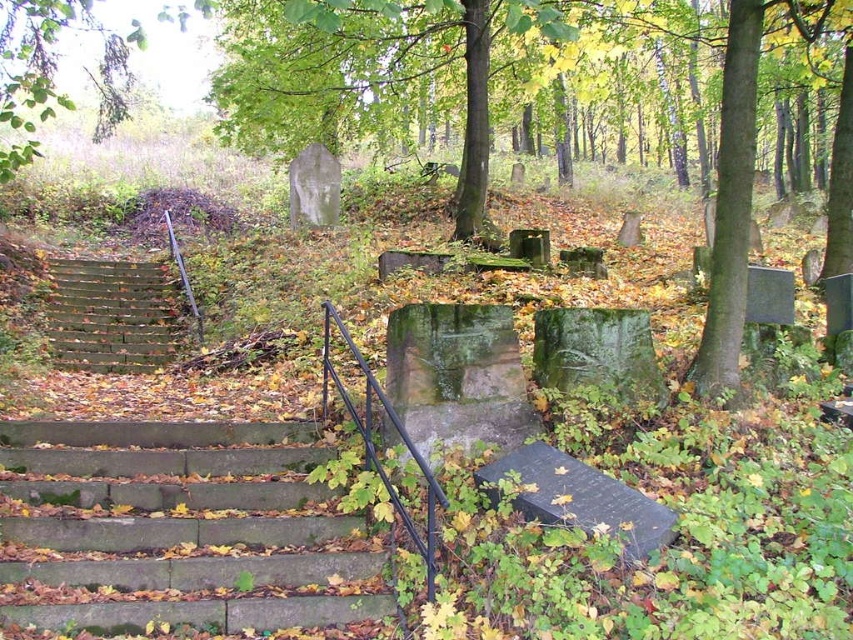
Who is more forward, (120, 74) or (125, 358)?

Point (125, 358) is in front.

Is point (828, 244) farther from camera compared to point (96, 321)?

No, (828, 244) is closer to viewer.

Is point (24, 67) less distant than point (76, 291)?

Yes.

Where is `green mossy stone at center`? green mossy stone at center is located at coordinates (489, 93).

Which of these two, green mossy stone at center or brown concrete stairs at lower left, stands shorter?

Standing shorter between the two is brown concrete stairs at lower left.

Is point (421, 20) positioned behind point (97, 625)?

Yes.

I want to click on green mossy stone at center, so click(489, 93).

Is point (126, 577) behind point (173, 356)?

No, it is in front of (173, 356).

Measure the distance between point (363,616) and camera.

They are 11.22 feet apart.

Locate an element on the screen. brown concrete stairs at lower left is located at coordinates (178, 532).